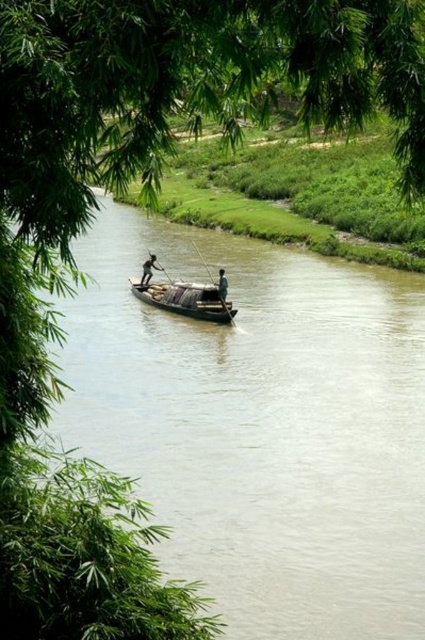
Question: Is brown wooden canoe at center closer to the viewer compared to wooden paddle at center?

Choices:
 (A) no
 (B) yes

Answer: (B)

Question: Which point is closer to the camera taking this photo?

Choices:
 (A) (142, 284)
 (B) (221, 292)
 (C) (362, 500)
 (D) (227, 312)

Answer: (C)

Question: Which object appears closest to the camera in this image?

Choices:
 (A) wooden paddle at center
 (B) brown wooden boat at center

Answer: (B)

Question: Is brown wooden canoe at center smaller than wooden paddle at center?

Choices:
 (A) no
 (B) yes

Answer: (B)

Question: Does wooden paddle at center have a smaller size compared to light brown wooden pole at center?

Choices:
 (A) yes
 (B) no

Answer: (B)

Question: Among these points, which one is farthest from the camera?

Choices:
 (A) (149, 269)
 (B) (224, 301)
 (C) (223, 284)
 (D) (410, 404)

Answer: (A)